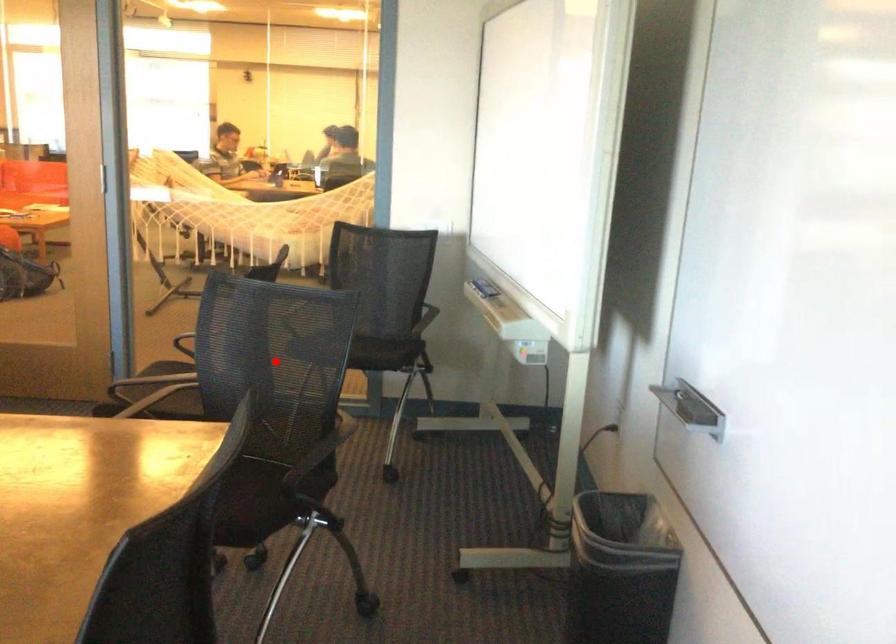
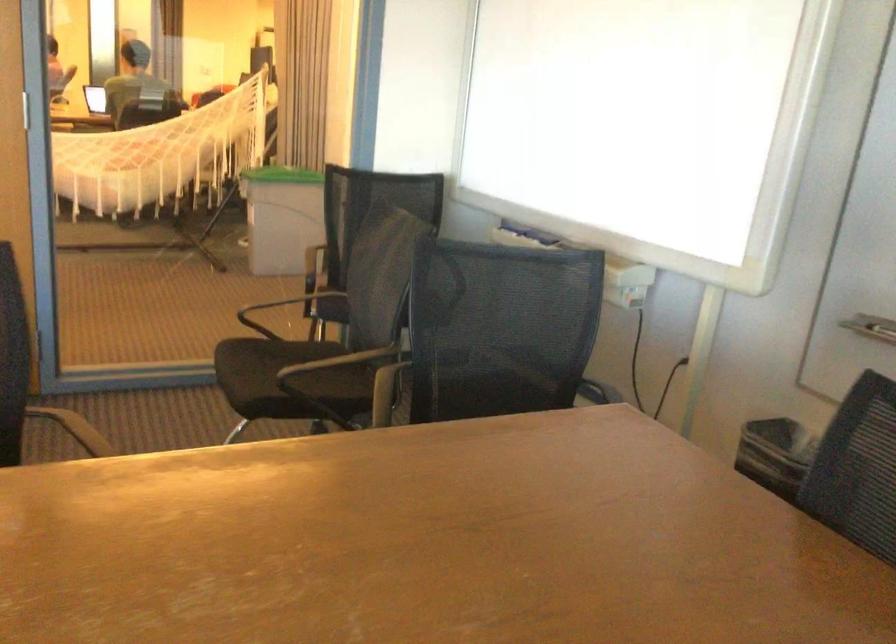
Where in the second image is the point corresponding to the highlighted location from the first image?

(501, 328)